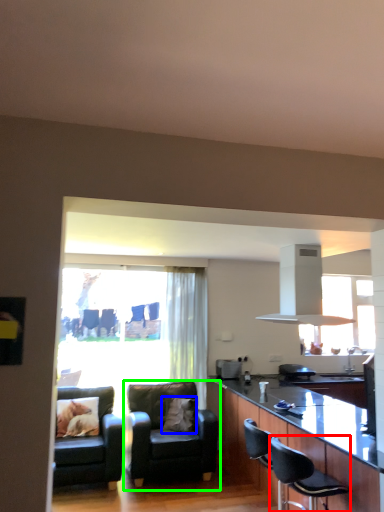
Question: Which is farther away from chair (highlighted by a red box)? pillow (highlighted by a blue box) or chair (highlighted by a green box)?

Choices:
 (A) pillow
 (B) chair

Answer: (A)